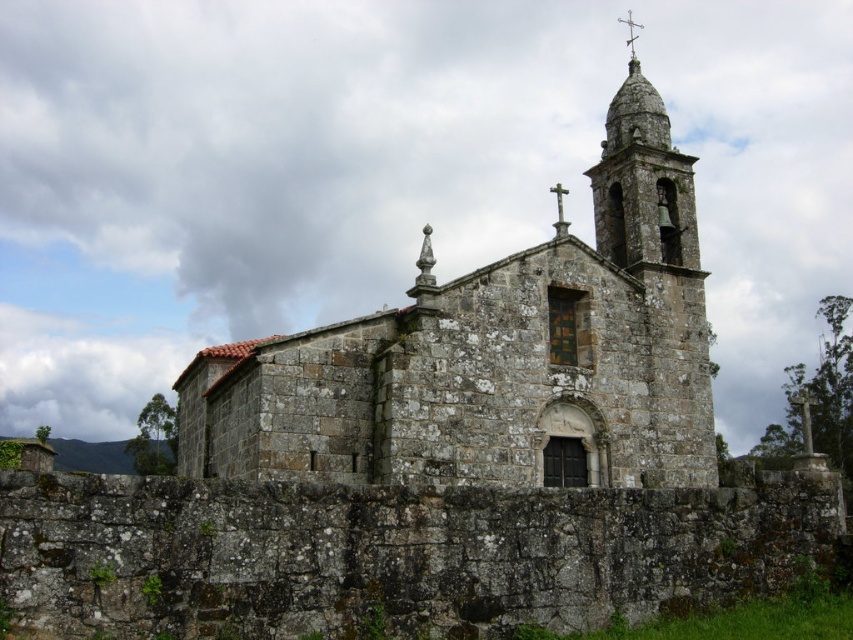
Question: Is rustic stone church at center wider than metallic cross at upper center?

Choices:
 (A) yes
 (B) no

Answer: (A)

Question: Which object appears closest to the camera in this image?

Choices:
 (A) metallic cross at upper center
 (B) rustic stone church at center

Answer: (B)

Question: Which of the following is the closest to the observer?

Choices:
 (A) (625, 40)
 (B) (614, 368)

Answer: (B)

Question: Is rustic stone church at center behind metallic cross at upper center?

Choices:
 (A) yes
 (B) no

Answer: (B)

Question: Among these points, which one is nearest to the camera?

Choices:
 (A) (244, 476)
 (B) (634, 38)

Answer: (A)

Question: Is rustic stone church at center closer to the viewer compared to metallic cross at upper center?

Choices:
 (A) yes
 (B) no

Answer: (A)